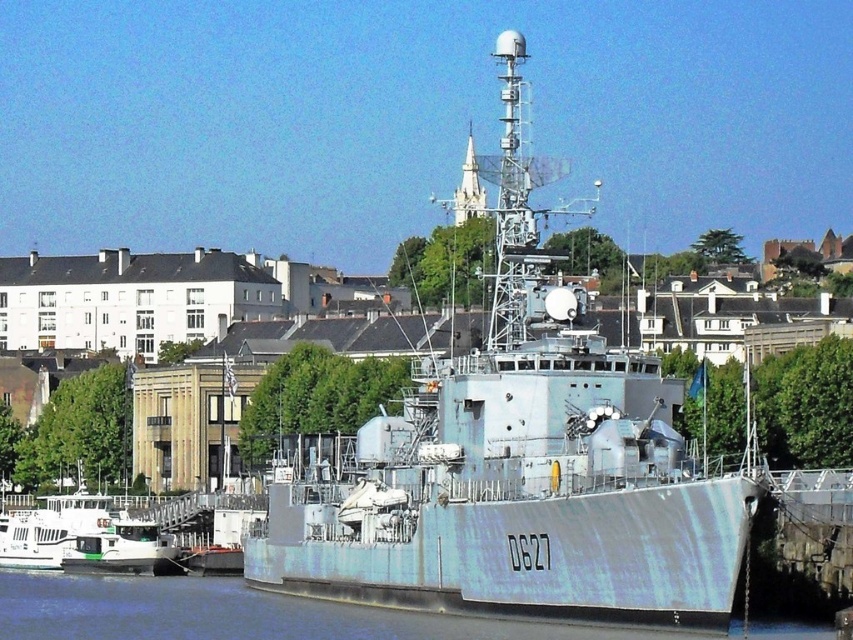
You are a sailor on the pier and want to board the light blue metallic ship at center. Which direction should you move relative to the blue metallic water at lower center to reach it?

The light blue metallic ship at center is located above the blue metallic water at lower center, so you should move towards the upper direction relative to the blue metallic water at lower center to reach it.

You are standing at the point marked as point (x=486, y=358) on a map of the waterfront. You want to take a photo of the naval ship D627 from a distance of exactly 300 feet. Is your current position suitable for this?

The distance between point (x=486, y=358) and the camera is 313.03 feet, which is slightly more than 300 feet. Therefore, your current position is not suitable for taking the photo at exactly 300 feet. You need to move closer by approximately 13 feet to achieve the desired distance.

You are standing on the pier next to the light blue metallic ship at center. You want to take a photo of the ship with your phone. Your phone has a maximum zoom range of 5x. The recommended distance for clear photos without zoom is 10 meters. Will you be able to take a clear photo of the ship without zooming in?

The light blue metallic ship at center is 79.95 meters away from you. Since the recommended distance for clear photos without zoom is 10 meters, you are much farther away than that. Therefore, you will not be able to take a clear photo of the ship without zooming in.